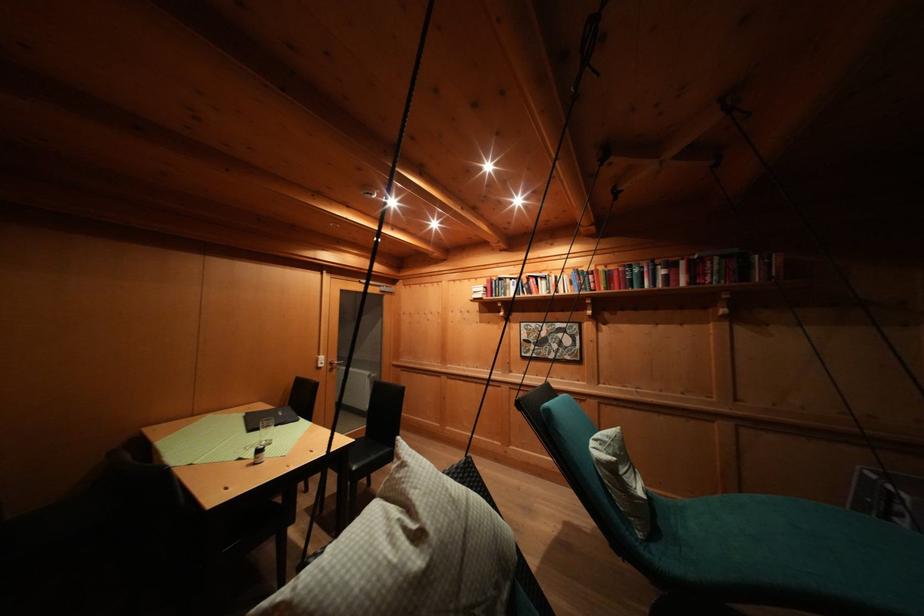
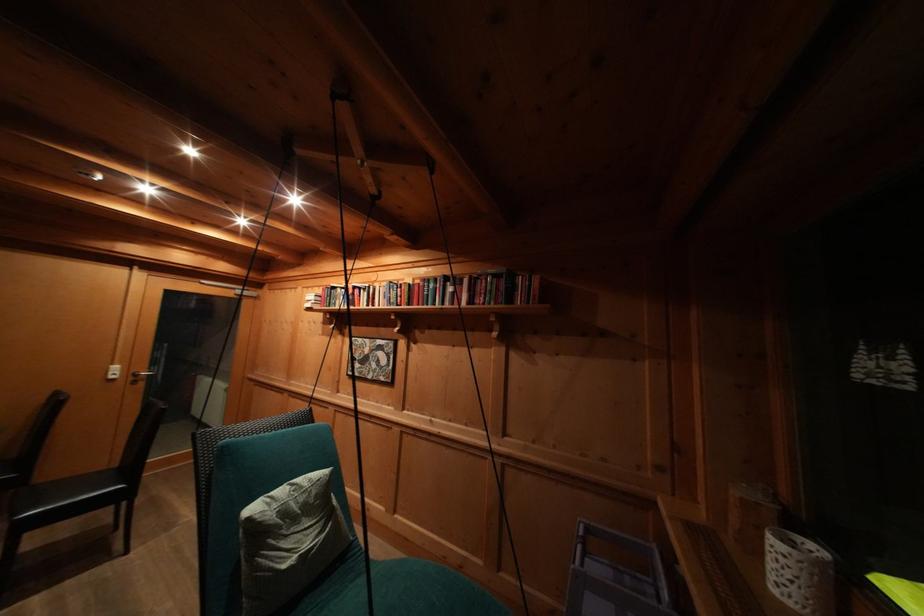
Locate, in the second image, the point that corresponds to point 642,275 in the first image.

(438, 291)